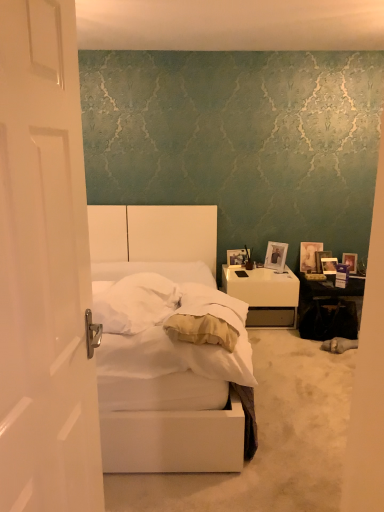
Describe the element at coordinates (237, 256) in the screenshot. The image size is (384, 512). I see `wooden photo frame at right, marked as the 5th picture frame in a right-to-left arrangement` at that location.

Where is `wooden photo frame at right, the third picture frame positioned from the right`? The image size is (384, 512). wooden photo frame at right, the third picture frame positioned from the right is located at coordinates (309, 255).

What is the approximate height of metallic silver picture frame at upper right, which is the 4th picture frame in left-to-right order?

It is 8.81 inches.

At what (x,y) coordinates should I click in order to perform the action: click on metallic silver picture frame at upper right, positioned as the 2th picture frame in right-to-left order. Please return your answer as a coordinate pair (x, y). Looking at the image, I should click on pyautogui.click(x=329, y=265).

Image resolution: width=384 pixels, height=512 pixels. What do you see at coordinates (164, 332) in the screenshot? I see `white soft mattress at center` at bounding box center [164, 332].

Locate an element on the screen. This screenshot has width=384, height=512. matte purple picture frame at right, acting as the first picture frame starting from the right is located at coordinates (350, 261).

Does wooden photo frame at right, acting as the 1th picture frame starting from the left, appear on the left side of white glossy nightstand at right?

Yes.

Considering the relative sizes of wooden photo frame at right, acting as the 1th picture frame starting from the left, and white glossy nightstand at right in the image provided, is wooden photo frame at right, acting as the 1th picture frame starting from the left, wider than white glossy nightstand at right?

In fact, wooden photo frame at right, acting as the 1th picture frame starting from the left, might be narrower than white glossy nightstand at right.

Is wooden photo frame at right, acting as the 1th picture frame starting from the left, not inside white glossy nightstand at right?

Absolutely, wooden photo frame at right, acting as the 1th picture frame starting from the left, is external to white glossy nightstand at right.

How far apart are wooden photo frame at right, acting as the 1th picture frame starting from the left, and white glossy nightstand at right?

A distance of 14.51 inches exists between wooden photo frame at right, acting as the 1th picture frame starting from the left, and white glossy nightstand at right.

Does matte silver picture frame at upper right, arranged as the second picture frame when viewed from the left, lie behind white glossy nightstand at right?

That is True.

This screenshot has width=384, height=512. What are the coordinates of `the 1st picture frame to the right when counting from the white glossy nightstand at right` in the screenshot? It's located at (276, 256).

Between point (279, 251) and point (244, 298), which one is positioned behind?

The point (279, 251) is more distant.

Does matte silver picture frame at upper right, the 4th picture frame from the right, have a smaller size compared to white glossy nightstand at right?

Yes.

Is white glossy door at left behind white glossy nightstand at right?

No, it is not.

From the image's perspective, relative to white glossy nightstand at right, is white glossy door at left above or below?

Based on their image positions, white glossy door at left is located above white glossy nightstand at right.

Can you confirm if white glossy door at left is wider than white glossy nightstand at right?

Incorrect, the width of white glossy door at left does not surpass that of white glossy nightstand at right.

Is point (35, 151) more distant than point (292, 294)?

No, (35, 151) is in front of (292, 294).

Locate an element on the screen. The height and width of the screenshot is (512, 384). table below the white soft mattress at center (from a real-world perspective) is located at coordinates (329, 309).

Is black glossy table at right oriented away from white soft mattress at center?

black glossy table at right is not turned away from white soft mattress at center.

In terms of size, does black glossy table at right appear bigger or smaller than white soft mattress at center?

Considering their sizes, black glossy table at right takes up less space than white soft mattress at center.

Looking at the image, does white glossy door at left seem bigger or smaller compared to matte purple picture frame at right, which is the 5th picture frame in left-to-right order?

In the image, white glossy door at left appears to be larger than matte purple picture frame at right, which is the 5th picture frame in left-to-right order.

Is white glossy door at left oriented towards matte purple picture frame at right, which is the 5th picture frame in left-to-right order?

No, white glossy door at left is not oriented towards matte purple picture frame at right, which is the 5th picture frame in left-to-right order.

Considering the sizes of white glossy door at left and matte purple picture frame at right, acting as the first picture frame starting from the right, in the image, is white glossy door at left taller or shorter than matte purple picture frame at right, acting as the first picture frame starting from the right,?

white glossy door at left is taller than matte purple picture frame at right, acting as the first picture frame starting from the right.

Is the surface of white glossy door at left in direct contact with matte purple picture frame at right, acting as the first picture frame starting from the right?

No.

Is wooden photo frame at right, the third picture frame positioned from the right, far away from matte purple picture frame at right, which is the 5th picture frame in left-to-right order?

wooden photo frame at right, the third picture frame positioned from the right, is near matte purple picture frame at right, which is the 5th picture frame in left-to-right order, not far away.

Considering their positions, is wooden photo frame at right, the third picture frame positioned from the right, located in front of or behind matte purple picture frame at right, which is the 5th picture frame in left-to-right order?

In the image, wooden photo frame at right, the third picture frame positioned from the right, appears behind matte purple picture frame at right, which is the 5th picture frame in left-to-right order.

From the picture: Is wooden photo frame at right, which appears as the 3th picture frame when viewed from the left, oriented away from matte purple picture frame at right, which is the 5th picture frame in left-to-right order?

No, wooden photo frame at right, which appears as the 3th picture frame when viewed from the left, is not facing away from matte purple picture frame at right, which is the 5th picture frame in left-to-right order.

In the image, is white soft mattress at center on the left side or the right side of white glossy nightstand at right?

Based on their positions, white soft mattress at center is located to the left of white glossy nightstand at right.

Considering the relative sizes of white soft mattress at center and white glossy nightstand at right in the image provided, is white soft mattress at center shorter than white glossy nightstand at right?

Yes.

Does white soft mattress at center turn towards white glossy nightstand at right?

No, white soft mattress at center is not turned towards white glossy nightstand at right.

Where is `picture frame on the left of the white glossy nightstand at right`? picture frame on the left of the white glossy nightstand at right is located at coordinates (237, 256).

Locate an element on the screen. The height and width of the screenshot is (512, 384). nightstand that is under the matte silver picture frame at upper right, the 4th picture frame from the right (from a real-world perspective) is located at coordinates (264, 295).

Based on the photo, estimate the real-world distances between objects in this image. Which object is further from metallic silver picture frame at upper right, which is the 4th picture frame in left-to-right order, wooden photo frame at right, the third picture frame positioned from the right, or black glossy table at right?

Based on the image, black glossy table at right appears to be further to metallic silver picture frame at upper right, which is the 4th picture frame in left-to-right order.

Based on their spatial positions, is white soft pillow at center or matte silver picture frame at upper right, arranged as the second picture frame when viewed from the left, closer to metallic silver picture frame at upper right, positioned as the 2th picture frame in right-to-left order?

The object closer to metallic silver picture frame at upper right, positioned as the 2th picture frame in right-to-left order, is matte silver picture frame at upper right, arranged as the second picture frame when viewed from the left.

When comparing their distances from white glossy nightstand at right, does matte silver picture frame at upper right, arranged as the second picture frame when viewed from the left, or white soft pillow at center seem closer?

The object closer to white glossy nightstand at right is matte silver picture frame at upper right, arranged as the second picture frame when viewed from the left.

From the image, which object appears to be farther from wooden photo frame at right, marked as the 5th picture frame in a right-to-left arrangement, metallic silver picture frame at upper right, positioned as the 2th picture frame in right-to-left order, or white soft pillow at center?

Based on the image, white soft pillow at center appears to be further to wooden photo frame at right, marked as the 5th picture frame in a right-to-left arrangement.

From the image, which object appears to be farther from black glossy table at right, white soft mattress at center or white soft pillow at center?

Based on the image, white soft pillow at center appears to be further to black glossy table at right.

Considering their positions, is matte silver picture frame at upper right, the 4th picture frame from the right, positioned closer to white glossy door at left than white glossy nightstand at right?

Based on the image, white glossy nightstand at right appears to be nearer to white glossy door at left.

When comparing their distances from black glossy table at right, does white glossy door at left or wooden photo frame at right, which appears as the 3th picture frame when viewed from the left, seem further?

Based on the image, white glossy door at left appears to be further to black glossy table at right.

Based on their spatial positions, is matte silver picture frame at upper right, the 4th picture frame from the right, or white matte bed at center closer to white soft mattress at center?

Among the two, white matte bed at center is located nearer to white soft mattress at center.

I want to click on nightstand positioned between white soft mattress at center and matte purple picture frame at right, which is the 5th picture frame in left-to-right order, from near to far, so click(x=264, y=295).

Find the location of `pillow between white matte bed at center and matte purple picture frame at right, acting as the first picture frame starting from the right, from front to back`. pillow between white matte bed at center and matte purple picture frame at right, acting as the first picture frame starting from the right, from front to back is located at coordinates (136, 303).

Image resolution: width=384 pixels, height=512 pixels. I want to click on bed between white glossy door at left and white soft mattress at center along the z-axis, so click(x=164, y=344).

The image size is (384, 512). I want to click on bed located between white glossy door at left and white soft pillow at center in the depth direction, so click(164, 344).